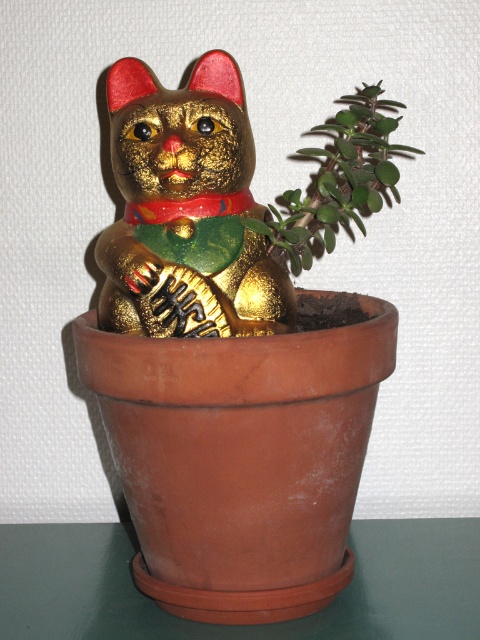
Does gold glitter cat at center have a greater width compared to green succulent at upper right?

Correct, the width of gold glitter cat at center exceeds that of green succulent at upper right.

Between point (228, 164) and point (397, 148), which one is positioned in front?

Point (228, 164) is in front.

This screenshot has height=640, width=480. Find the location of `gold glitter cat at center`. gold glitter cat at center is located at coordinates (187, 211).